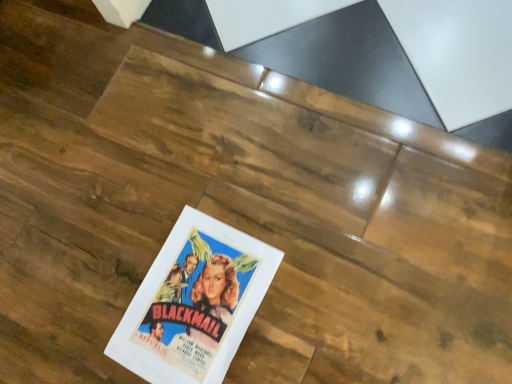
I want to click on free space to the left of matte paper poster at center, so click(68, 311).